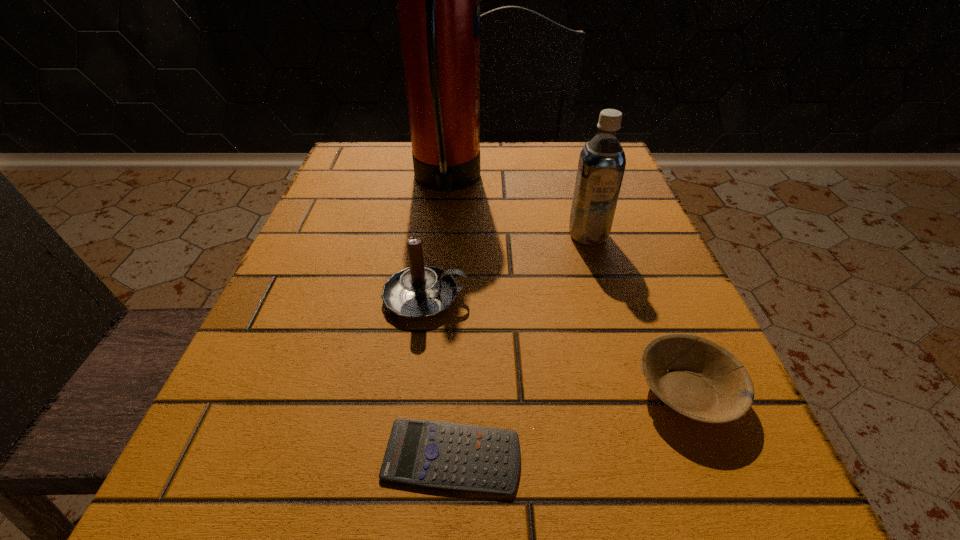
This screenshot has height=540, width=960. Find the location of `vacant area situated on the side of the candle with the handle loop`. vacant area situated on the side of the candle with the handle loop is located at coordinates (633, 298).

You are a GUI agent. You are given a task and a screenshot of the screen. Output one action in this format:
    pyautogui.click(x=<x>, y=<y>)
    Task: Click on the free region located 0.280m on the back of the bowl
    
    Given the screenshot: What is the action you would take?
    pyautogui.click(x=622, y=232)

The image size is (960, 540). I want to click on free region located 0.100m on the left of the shortest object, so click(x=296, y=457).

This screenshot has width=960, height=540. In order to click on object that is at the far edge in this screenshot , I will do `click(438, 0)`.

Identify the location of object positioned at the near edge. This screenshot has width=960, height=540. (441, 455).

What are the coordinates of `soya milk present at the right edge` in the screenshot? It's located at (602, 161).

Image resolution: width=960 pixels, height=540 pixels. What are the coordinates of `bowl at the right edge` in the screenshot? It's located at (705, 382).

Where is `vacant space at the far edge of the desktop`? This screenshot has width=960, height=540. vacant space at the far edge of the desktop is located at coordinates (503, 160).

The image size is (960, 540). Find the location of `free space at the near edge of the desktop`. free space at the near edge of the desktop is located at coordinates (565, 502).

This screenshot has height=540, width=960. What are the coordinates of `vacant space at the left edge` in the screenshot? It's located at (372, 299).